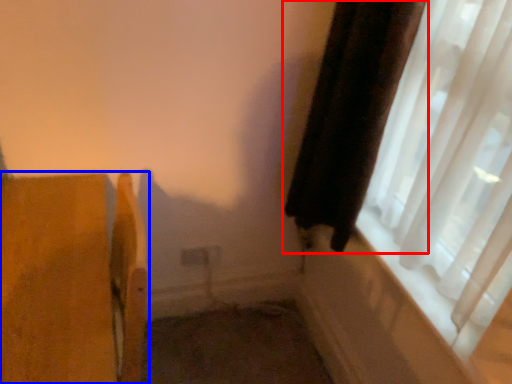
Question: Which point is closer to the camera, curtain (highlighted by a red box) or furniture (highlighted by a blue box)?

Choices:
 (A) curtain
 (B) furniture

Answer: (B)